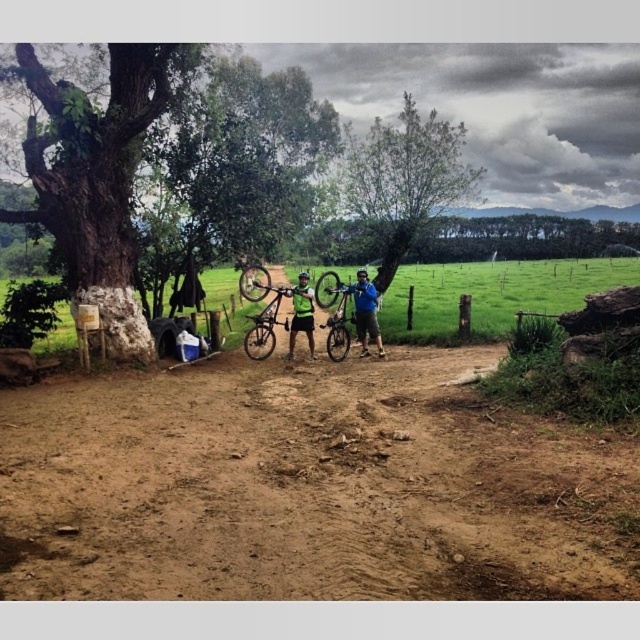
You are a hiker planning to cross the dirt path in the image. The shiny silver mountain bike at center is parked there. Can you safely walk over the brown sandy dirt at center without stepping on the bike?

The brown sandy dirt at center is shorter than the shiny silver mountain bike at center, so the bike is taller. Therefore, you can safely walk over the brown sandy dirt at center without stepping on the bike as there is enough space between them.

You are planning to set up a small tent on the brown sandy dirt at center. Considering the size of the shiny silver mountain bike at center, will there be enough space to place the tent without it overlapping with the bike?

The brown sandy dirt at center has a smaller size compared to the shiny silver mountain bike at center, so there might not be enough space to place the tent without overlapping with the bike.